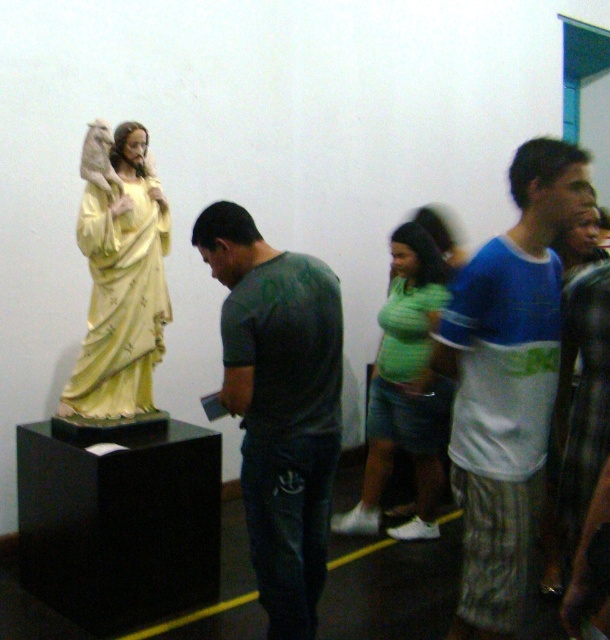
Looking at this image, does white cotton shirt at center appear on the right side of matte yellow statue at left?

Indeed, white cotton shirt at center is positioned on the right side of matte yellow statue at left.

Is point (478, 484) farther from camera compared to point (159, 218)?

No.

The image size is (610, 640). Describe the element at coordinates (506, 381) in the screenshot. I see `white cotton shirt at center` at that location.

Find the location of a particular element. This screenshot has width=610, height=640. white cotton shirt at center is located at coordinates pyautogui.click(x=506, y=381).

Does point (468, 548) come in front of point (400, 257)?

Yes, it is.

Does point (512, 598) come behind point (359, 525)?

That is False.

Between point (509, 422) and point (434, 474), which one is positioned in front?

Point (509, 422)

You are a GUI agent. You are given a task and a screenshot of the screen. Output one action in this format:
    pyautogui.click(x=<x>, y=<y>)
    Task: Click on the white cotton shirt at center
    
    Given the screenshot: What is the action you would take?
    pyautogui.click(x=506, y=381)

Who is more forward, (503,611) or (318,333)?

Positioned in front is point (503,611).

Between point (472, 458) and point (270, 513), which one is positioned behind?

The point (270, 513) is more distant.

Find the location of `white cotton shirt at center`. white cotton shirt at center is located at coordinates (506, 381).